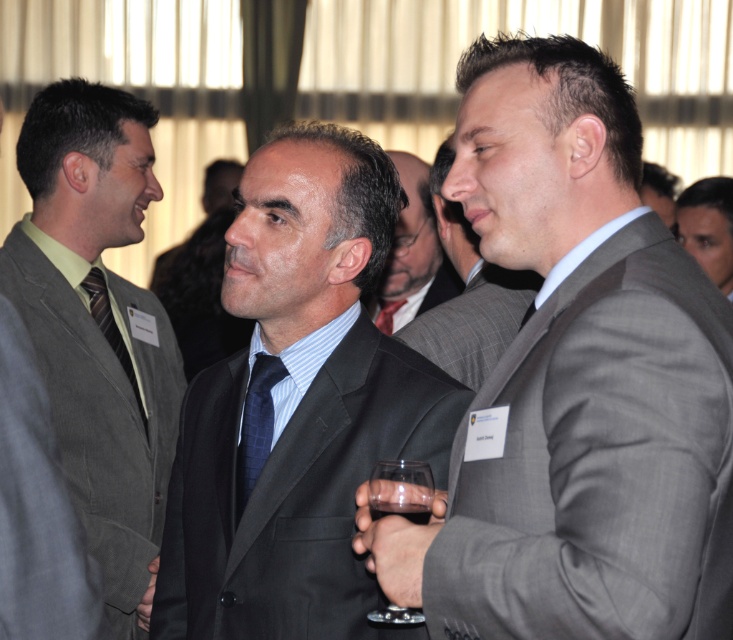
Question: Considering the real-world distances, which object is closest to the gray pinstripe suit at center?

Choices:
 (A) dark blue textured tie at center
 (B) dark gray suit at center
 (C) matte gray suit at center

Answer: (B)

Question: Can you confirm if smooth gray suit at right is bigger than dark liquid glass at center?

Choices:
 (A) yes
 (B) no

Answer: (A)

Question: Can you confirm if matte gray suit at center is thinner than dark blue textured tie at center?

Choices:
 (A) no
 (B) yes

Answer: (A)

Question: Considering the relative positions of dark gray suit at center and blue silk tie at center in the image provided, where is dark gray suit at center located with respect to blue silk tie at center?

Choices:
 (A) below
 (B) above

Answer: (A)

Question: Which object is farther from the camera taking this photo?

Choices:
 (A) striped fabric tie at center
 (B) gray pinstripe suit at center
 (C) gray suit at center

Answer: (C)

Question: Which object is farther from the camera taking this photo?

Choices:
 (A) smooth gray suit at right
 (B) gray suit at center
 (C) blue silk tie at center
 (D) matte gray suit at center

Answer: (B)